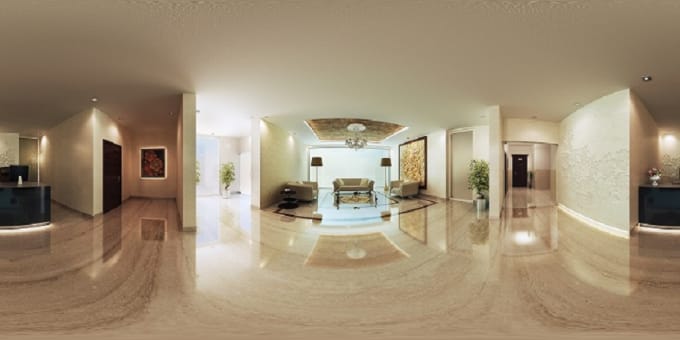
Locate an element on the screen. Image resolution: width=680 pixels, height=340 pixels. house plant is located at coordinates (481, 179), (224, 173), (198, 171).